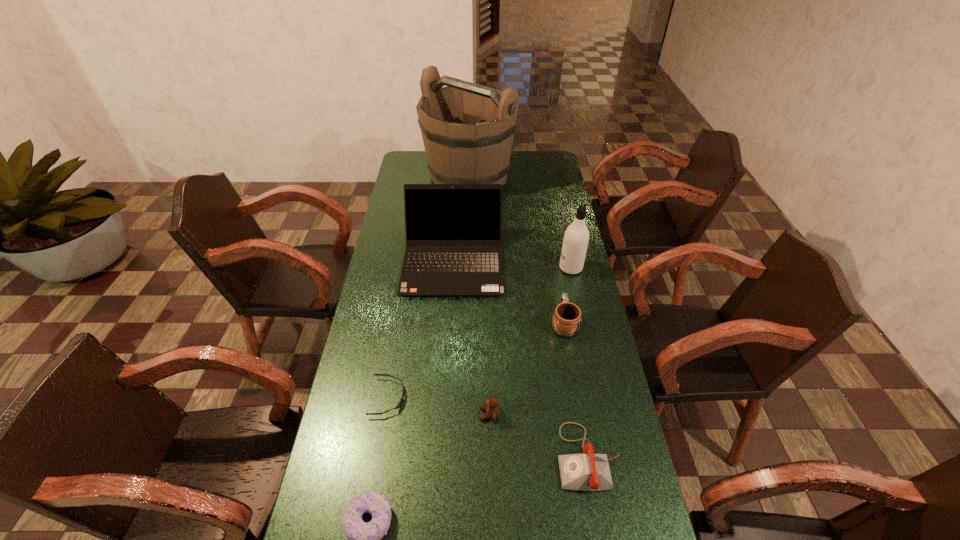
Where is `free point located on the dial of the third shortest object`? free point located on the dial of the third shortest object is located at coordinates (498, 457).

Image resolution: width=960 pixels, height=540 pixels. Identify the location of vacant space located on the dial of the third shortest object. (502, 457).

You are a GUI agent. You are given a task and a screenshot of the screen. Output one action in this format:
    pyautogui.click(x=<x>, y=<y>)
    Task: Click on the vacant position located on the front-facing side of the shortest object
    The image size is (960, 540).
    Given the screenshot: What is the action you would take?
    pyautogui.click(x=462, y=397)

Identify the location of object positioned at the far edge. (467, 129).

Where is `bucket that is at the left edge`? The height and width of the screenshot is (540, 960). bucket that is at the left edge is located at coordinates (467, 129).

Identify the location of laptop computer that is at the left edge. (453, 231).

The image size is (960, 540). Find the location of `sunglasses that is at the left edge`. sunglasses that is at the left edge is located at coordinates (399, 404).

Where is `shampoo that is at the right edge`? shampoo that is at the right edge is located at coordinates (576, 237).

Image resolution: width=960 pixels, height=540 pixels. What are the coordinates of `mug at the right edge` in the screenshot? It's located at (567, 318).

The height and width of the screenshot is (540, 960). I want to click on telephone that is at the right edge, so click(588, 471).